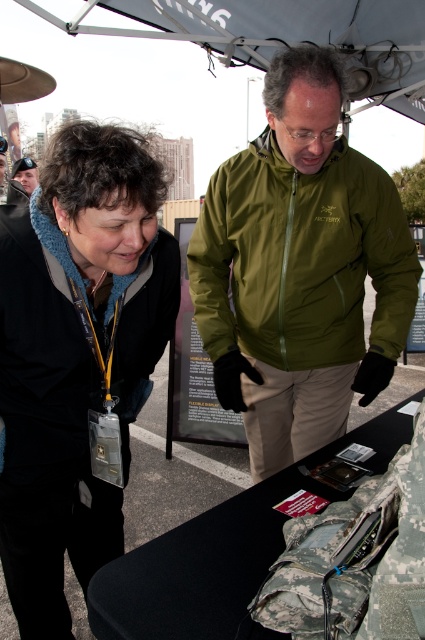
What are the coordinates of the olive green jacket at center?

The olive green jacket at center is located at coordinates point (300, 268).

You are helping organize a clothing donation drive and need to categorize jackets by size. You have an olive green jacket at center and a black fleece jacket at upper left. Which jacket should you place in the large size bin?

The olive green jacket at center has a larger size compared to the black fleece jacket at upper left, so it should be placed in the large size bin.